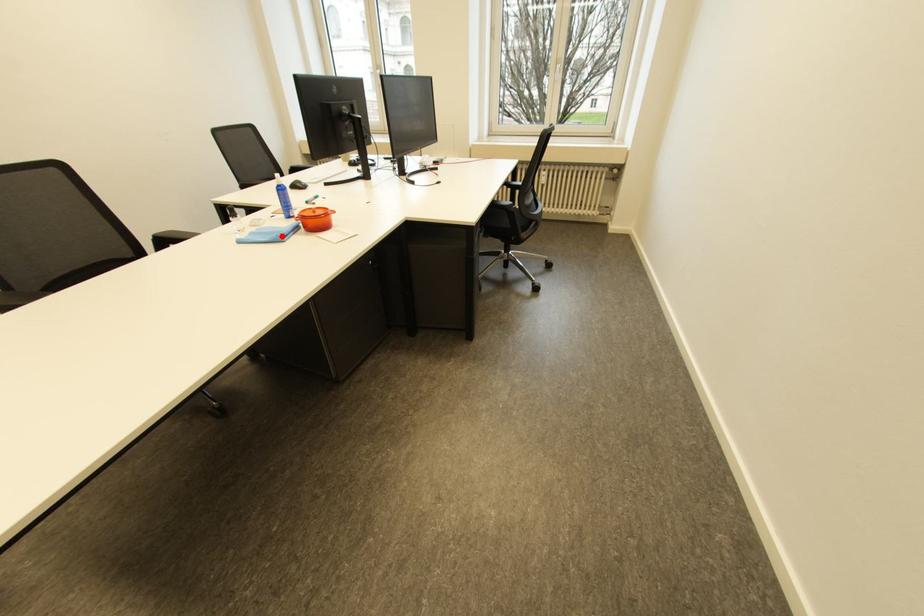
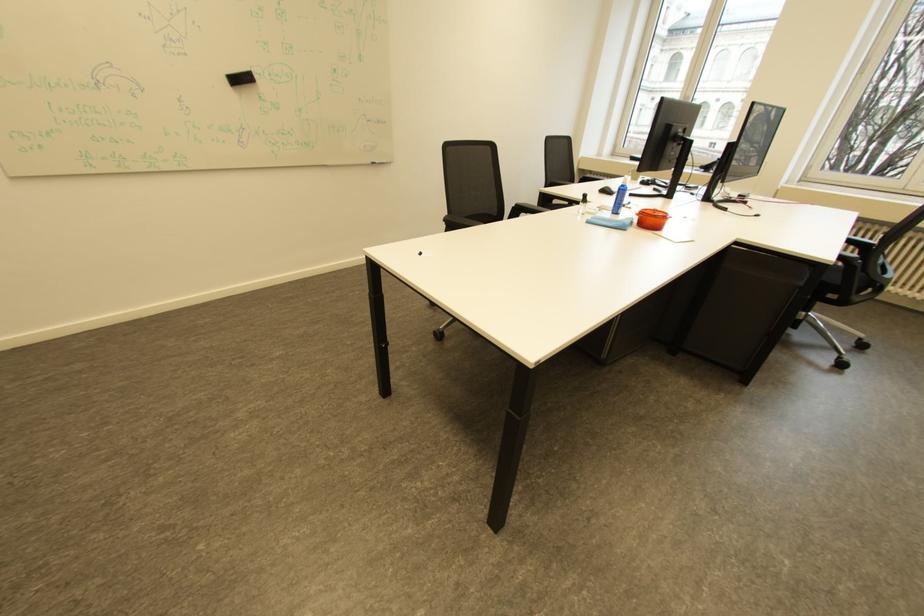
Locate, in the second image, the point that corresponds to the highlighted location in the first image.

(627, 224)